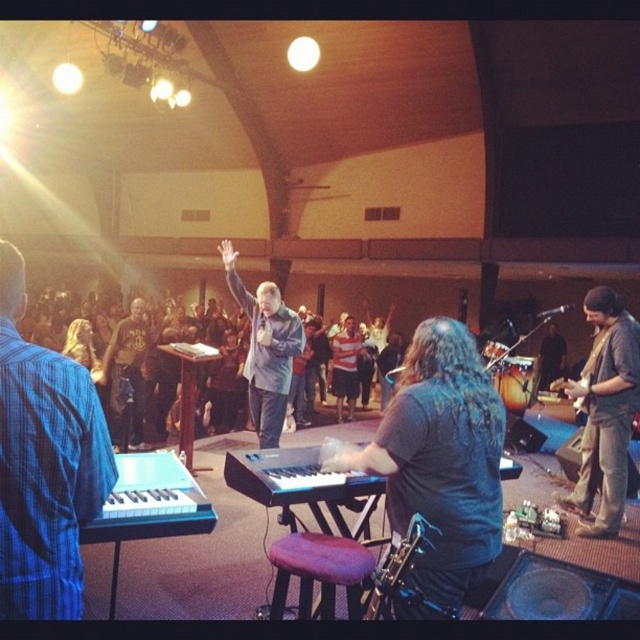
Is point (300, 332) positioned before point (262, 476)?

No, (300, 332) is further to viewer.

Where is `matte gray suit at center`? The image size is (640, 640). matte gray suit at center is located at coordinates [x=266, y=349].

Locate an element on the screen. The width and height of the screenshot is (640, 640). matte gray suit at center is located at coordinates (266, 349).

Is denim jacket at right shorter than dark brown leather jacket at center?

No.

Between denim jacket at right and dark brown leather jacket at center, which one is positioned lower?

denim jacket at right is below.

Where is `denim jacket at right`? denim jacket at right is located at coordinates (604, 412).

The image size is (640, 640). Identify the location of denim jacket at right. (604, 412).

Does blue plaid shirt at left lie behind dark brown leather jacket at center?

That is False.

Is point (61, 593) more distant than point (128, 396)?

No, it is not.

Image resolution: width=640 pixels, height=640 pixels. I want to click on blue plaid shirt at left, so click(44, 464).